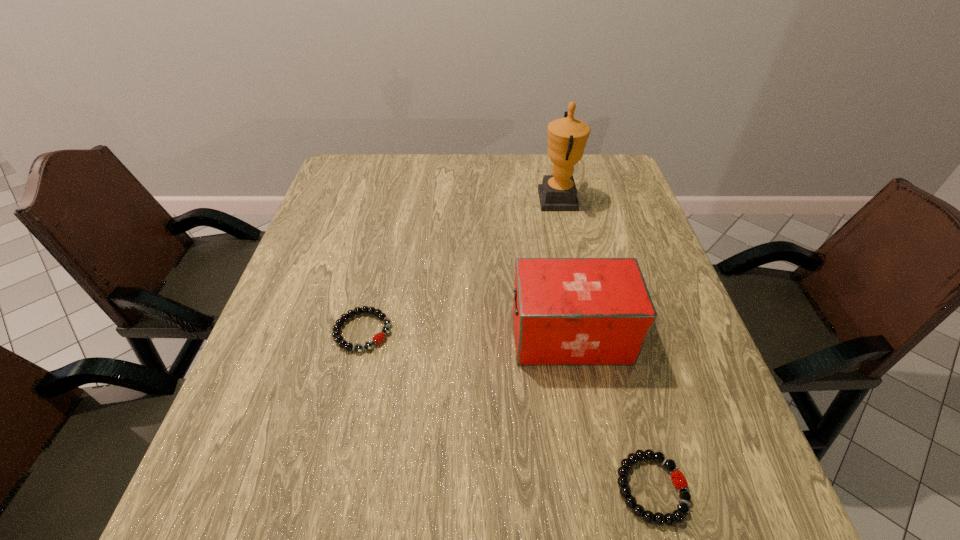
Where is `vacant space located on the handle side of the third shortest object`? vacant space located on the handle side of the third shortest object is located at coordinates (454, 336).

You are a GUI agent. You are given a task and a screenshot of the screen. Output one action in this format:
    pyautogui.click(x=<x>, y=<y>)
    Task: Click on the blank space located on the handle side of the third shortest object
    
    Given the screenshot: What is the action you would take?
    pyautogui.click(x=430, y=336)

Find the location of a particular element. This screenshot has height=540, width=960. vacant position located 0.070m on the handle side of the third shortest object is located at coordinates (478, 336).

Identify the location of blank space located 0.070m on the back of the leftmost object. The image size is (960, 540). (373, 287).

Where is `vacant space located on the left of the nearest object`? The width and height of the screenshot is (960, 540). vacant space located on the left of the nearest object is located at coordinates (399, 488).

Locate an element on the screen. Image resolution: width=960 pixels, height=540 pixels. object at the far edge is located at coordinates (567, 137).

Find the location of `object situated at the near edge`. object situated at the near edge is located at coordinates (678, 479).

Locate an element on the screen. The width and height of the screenshot is (960, 540). object that is at the left edge is located at coordinates (378, 338).

Where is `the first-aid kit situated at the right edge`? The image size is (960, 540). the first-aid kit situated at the right edge is located at coordinates (567, 311).

Identify the location of bracelet present at the right edge. Image resolution: width=960 pixels, height=540 pixels. (678, 479).